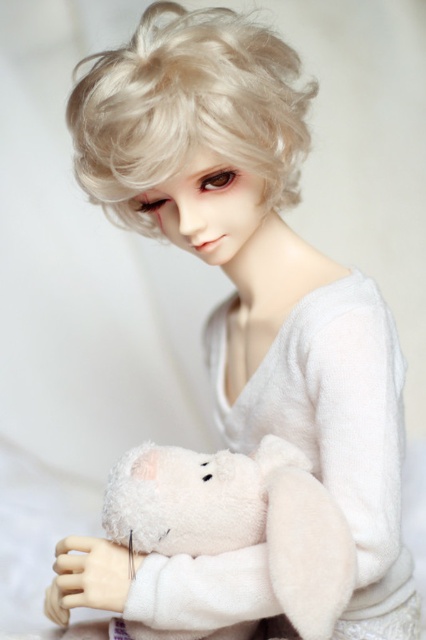
You are a photographer setting up a shot of the doll. You need to know if the white fluffy robe at center and the white plush bear at center are close enough to be in focus simultaneously. The camera can focus on objects within 10 centimeters of each other. Can they both be in focus?

The white fluffy robe at center and white plush bear at center are 11.14 centimeters apart, which is more than the 10 centimeter focus range. Therefore, they cannot both be in focus at the same time.

You are a toy organizer who needs to stack the blonde curly wig at upper center and the white plush bear at center vertically on a shelf. Can you place the taller one on top without it falling over?

The blonde curly wig at upper center is taller than the white plush bear at center, so placing it on top might be unstable. It is better to place the shorter white plush bear at center on the bottom for stability.

You are a fashion designer observing the doll in the scene. You need to decide the order of placing the white fluffy robe at center and the blonde curly wig at upper center. Which item should be placed first to match the current arrangement?

The white fluffy robe at center should be placed first because it is positioned under the blonde curly wig at upper center in the current arrangement.